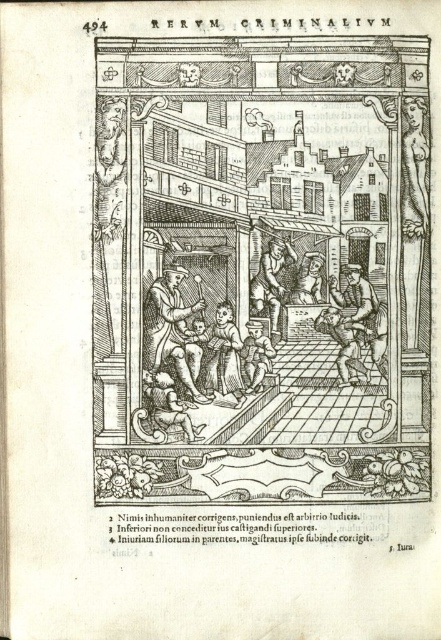
Is the wooden staff at center wider than the wooden chair at center?

The wooden staff at center is wider than the wooden chair at center according to the description.

You are a traveler passing through the town square and notice both the wooden staff at center and the wooden chair at center. Which object would you estimate to be bigger in size?

The wooden staff at center is larger in size than the wooden chair at center, so the wooden staff at center would be the bigger object.

You are an observer in the town square. You see a wooden staff at center and a wooden chair at center. Which object is closer to the ground?

The wooden staff at center is located below the wooden chair at center, so the wooden staff at center is closer to the ground.